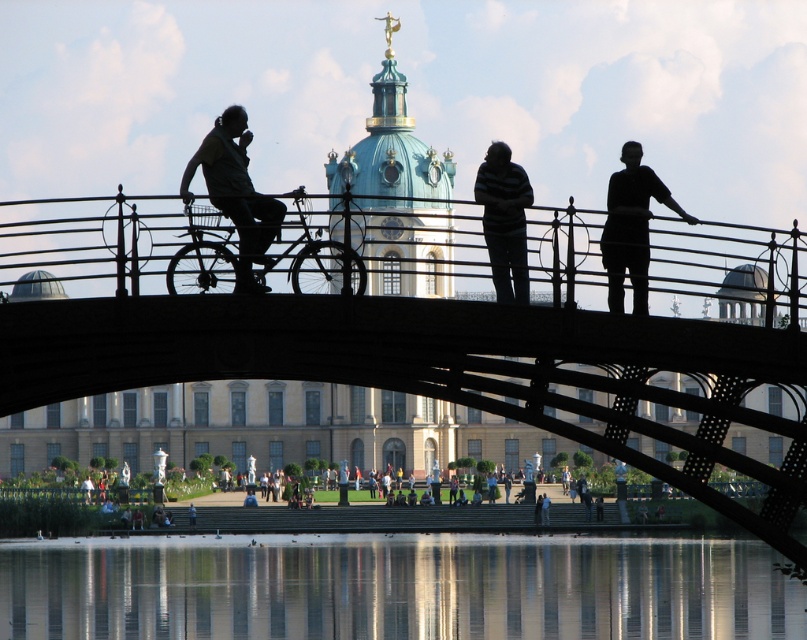
Which object is located at the coordinates point [236,193]?

The point [236,193] corresponds to the silhouette fabric covered figure at left.